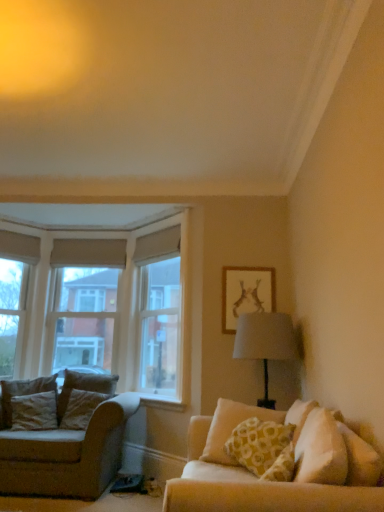
Question: Is velvet beige pillow at left, which ranks as the third pillow in front-to-back order, wider or thinner than beige fabric couch at left?

Choices:
 (A) wide
 (B) thin

Answer: (B)

Question: Is point (69, 406) positioned closer to the camera than point (64, 466)?

Choices:
 (A) farther
 (B) closer

Answer: (A)

Question: Which object is the farthest from the beige fabric couch at left?

Choices:
 (A) velvet beige pillow at left, which ranks as the third pillow in front-to-back order
 (B) velvet brown pillow at left, positioned as the third pillow in right-to-left order
 (C) white painted wood at lower center
 (D) yellow printed cushion at right, marked as the 1th pillow in a right-to-left arrangement
 (E) clear glass window at upper center

Answer: (D)

Question: Which is farther from the matte gold picture frame at upper right?

Choices:
 (A) white painted wood at lower center
 (B) yellow printed cushion at right, marked as the 1th pillow in a right-to-left arrangement
 (C) beige fabric couch at left
 (D) velvet beige pillow at left, positioned as the 2th pillow in right-to-left order
 (E) clear glass window at upper center

Answer: (D)